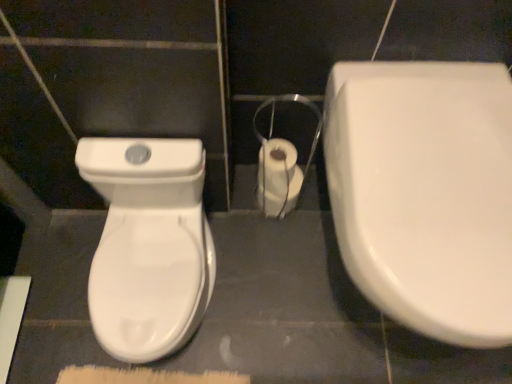
Locate an element on the screen. white glossy toilet at left, which ranks as the 1th toilet in left-to-right order is located at coordinates (148, 244).

What do you see at coordinates (425, 193) in the screenshot?
I see `white glossy toilet at right, which appears as the 2th toilet when viewed from the left` at bounding box center [425, 193].

What is the approximate height of white glossy toilet at right, which appears as the 2th toilet when viewed from the left?

It is 19.42 inches.

The height and width of the screenshot is (384, 512). What do you see at coordinates (278, 177) in the screenshot?
I see `white glossy toilet paper at center` at bounding box center [278, 177].

Where is `white glossy toilet at left, which is counted as the 2th toilet, starting from the right`? This screenshot has width=512, height=384. white glossy toilet at left, which is counted as the 2th toilet, starting from the right is located at coordinates pyautogui.click(x=148, y=244).

Which is in front, white glossy toilet at left, which is counted as the 2th toilet, starting from the right, or white glossy toilet at right, the first toilet positioned from the right?

white glossy toilet at right, the first toilet positioned from the right.

Is white glossy toilet at left, which is counted as the 2th toilet, starting from the right, beside white glossy toilet at right, which appears as the 2th toilet when viewed from the left?

white glossy toilet at left, which is counted as the 2th toilet, starting from the right, and white glossy toilet at right, which appears as the 2th toilet when viewed from the left, are clearly separated.

Between white glossy toilet at left, which is counted as the 2th toilet, starting from the right, and white glossy toilet at right, which appears as the 2th toilet when viewed from the left, which one has larger size?

With larger size is white glossy toilet at right, which appears as the 2th toilet when viewed from the left.

Find the location of a particular element. toilet that appears on the right of white glossy toilet at left, which is counted as the 2th toilet, starting from the right is located at coordinates (425, 193).

Is point (91, 183) farther from camera compared to point (289, 171)?

No.

Which object is positioned more to the left, white glossy toilet at left, which ranks as the 1th toilet in left-to-right order, or white glossy toilet paper at center?

white glossy toilet at left, which ranks as the 1th toilet in left-to-right order, is more to the left.

Is white glossy toilet at left, which is counted as the 2th toilet, starting from the right, bigger or smaller than white glossy toilet paper at center?

white glossy toilet at left, which is counted as the 2th toilet, starting from the right, is bigger than white glossy toilet paper at center.

From a real-world perspective, is white glossy toilet paper at center positioned above or below white glossy toilet at left, which is counted as the 2th toilet, starting from the right?

Clearly, from a real-world perspective, white glossy toilet paper at center is below white glossy toilet at left, which is counted as the 2th toilet, starting from the right.

Locate an element on the screen. This screenshot has width=512, height=384. toilet on the left of white glossy toilet paper at center is located at coordinates (148, 244).

Which of these two, white glossy toilet paper at center or white glossy toilet at left, which ranks as the 1th toilet in left-to-right order, is smaller?

Smaller between the two is white glossy toilet paper at center.

From the picture: Does white glossy toilet paper at center have a greater width compared to white glossy toilet at left, which ranks as the 1th toilet in left-to-right order?

No, white glossy toilet paper at center is not wider than white glossy toilet at left, which ranks as the 1th toilet in left-to-right order.

Considering the sizes of white glossy toilet at right, the first toilet positioned from the right, and white glossy toilet at left, which is counted as the 2th toilet, starting from the right, in the image, is white glossy toilet at right, the first toilet positioned from the right, wider or thinner than white glossy toilet at left, which is counted as the 2th toilet, starting from the right,?

Considering their sizes, white glossy toilet at right, the first toilet positioned from the right, looks broader than white glossy toilet at left, which is counted as the 2th toilet, starting from the right.

Which is more to the right, white glossy toilet at right, which appears as the 2th toilet when viewed from the left, or white glossy toilet at left, which is counted as the 2th toilet, starting from the right?

white glossy toilet at right, which appears as the 2th toilet when viewed from the left, is more to the right.

Considering the points (418, 209) and (104, 160), which point is in front, point (418, 209) or point (104, 160)?

The point (418, 209) is closer.

Consider the image. From a real-world perspective, is white glossy toilet at right, the first toilet positioned from the right, beneath white glossy toilet paper at center?

Incorrect, from a real-world perspective, white glossy toilet at right, the first toilet positioned from the right, is higher than white glossy toilet paper at center.

Is point (400, 129) less distant than point (293, 206)?

Yes.

Is white glossy toilet at right, the first toilet positioned from the right, touching white glossy toilet paper at center?

No, white glossy toilet at right, the first toilet positioned from the right, is not touching white glossy toilet paper at center.

This screenshot has height=384, width=512. I want to click on toilet that is the 2nd object located in front of the white glossy toilet paper at center, so click(x=425, y=193).

Does point (277, 186) lie behind point (407, 85)?

Yes, point (277, 186) is farther from viewer.

From the image's perspective, which one is positioned higher, white glossy toilet paper at center or white glossy toilet at right, the first toilet positioned from the right?

white glossy toilet paper at center, from the image's perspective.

Is white glossy toilet paper at center far from white glossy toilet at right, which appears as the 2th toilet when viewed from the left?

No.

Does white glossy toilet paper at center have a larger size compared to white glossy toilet at right, the first toilet positioned from the right?

Actually, white glossy toilet paper at center might be smaller than white glossy toilet at right, the first toilet positioned from the right.

The height and width of the screenshot is (384, 512). In order to click on toilet that is above the white glossy toilet at left, which ranks as the 1th toilet in left-to-right order (from the image's perspective) in this screenshot , I will do `click(425, 193)`.

You are a GUI agent. You are given a task and a screenshot of the screen. Output one action in this format:
    pyautogui.click(x=<x>, y=<y>)
    Task: Click on the toilet paper that appears below the white glossy toilet at left, which ranks as the 1th toilet in left-to-right order (from a real-world perspective)
    The image size is (512, 384).
    Given the screenshot: What is the action you would take?
    pyautogui.click(x=278, y=177)

Which object lies nearer to the anchor point white glossy toilet at right, the first toilet positioned from the right, white glossy toilet paper at center or white glossy toilet at left, which is counted as the 2th toilet, starting from the right?

white glossy toilet paper at center lies closer to white glossy toilet at right, the first toilet positioned from the right, than the other object.

Estimate the real-world distances between objects in this image. Which object is closer to white glossy toilet paper at center, white glossy toilet at right, the first toilet positioned from the right, or white glossy toilet at left, which ranks as the 1th toilet in left-to-right order?

white glossy toilet at left, which ranks as the 1th toilet in left-to-right order, is positioned closer to the anchor white glossy toilet paper at center.

Considering their positions, is white glossy toilet paper at center positioned closer to white glossy toilet at left, which is counted as the 2th toilet, starting from the right, than white glossy toilet at right, the first toilet positioned from the right?

The object closer to white glossy toilet at left, which is counted as the 2th toilet, starting from the right, is white glossy toilet paper at center.

When comparing their distances from white glossy toilet at right, the first toilet positioned from the right, does white glossy toilet at left, which ranks as the 1th toilet in left-to-right order, or white glossy toilet paper at center seem further?

Among the two, white glossy toilet at left, which ranks as the 1th toilet in left-to-right order, is located further to white glossy toilet at right, the first toilet positioned from the right.

Based on the photo, when comparing their distances from white glossy toilet paper at center, does white glossy toilet at left, which ranks as the 1th toilet in left-to-right order, or white glossy toilet at right, which appears as the 2th toilet when viewed from the left, seem closer?

white glossy toilet at left, which ranks as the 1th toilet in left-to-right order, is positioned closer to the anchor white glossy toilet paper at center.

Which object lies nearer to the anchor point white glossy toilet at left, which is counted as the 2th toilet, starting from the right, white glossy toilet at right, the first toilet positioned from the right, or white glossy toilet paper at center?

white glossy toilet paper at center is closer to white glossy toilet at left, which is counted as the 2th toilet, starting from the right.

Locate an element on the screen. This screenshot has width=512, height=384. toilet paper between white glossy toilet at left, which ranks as the 1th toilet in left-to-right order, and white glossy toilet at right, which appears as the 2th toilet when viewed from the left, from left to right is located at coordinates (278, 177).